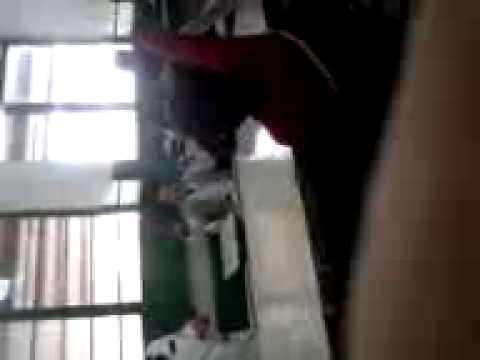
Find the location of a particular element. sunlight coming through window is located at coordinates (83, 79).